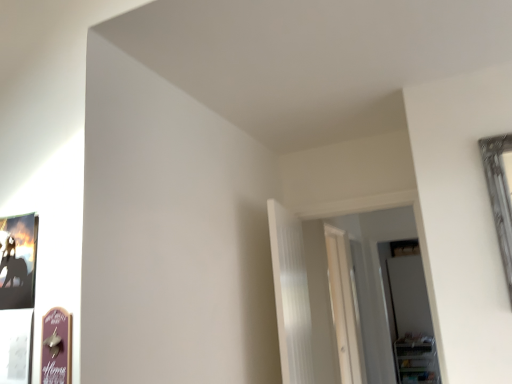
Question: Looking at the image, does white ribbed curtain at center seem bigger or smaller compared to transparent glass door at right, the second glass door when ordered from front to back?

Choices:
 (A) small
 (B) big

Answer: (B)

Question: Relative to transparent glass door at right, the 1th glass door from the back, is white ribbed curtain at center in front or behind?

Choices:
 (A) behind
 (B) front

Answer: (B)

Question: Which is farther from the transparent glass door at center, which ranks as the 2th glass door in back-to-front order?

Choices:
 (A) white ribbed curtain at center
 (B) transparent glass door at right, which is the 1th glass door from right to left
 (C) wooden sign at lower left
 (D) clear plastic shelf at lower right

Answer: (C)

Question: Which object is positioned closest to the white ribbed curtain at center?

Choices:
 (A) wooden sign at lower left
 (B) transparent glass door at center, which appears as the second glass door when viewed from the right
 (C) clear plastic shelf at lower right
 (D) transparent glass door at right, which is the 1th glass door from right to left

Answer: (A)